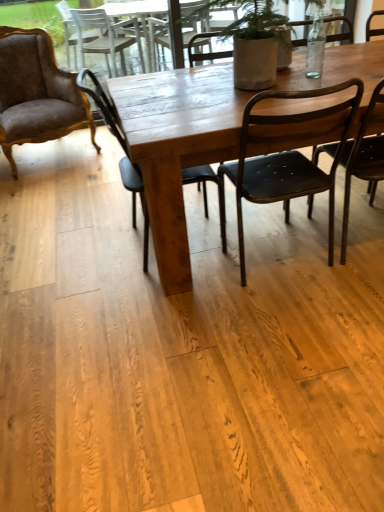
The image size is (384, 512). In order to click on vacant area that lies between black metal chair at right, which is counted as the 1th chair, starting from the right, and black metal chair at center, which is the second chair in right-to-left order in this screenshot , I will do `click(317, 254)`.